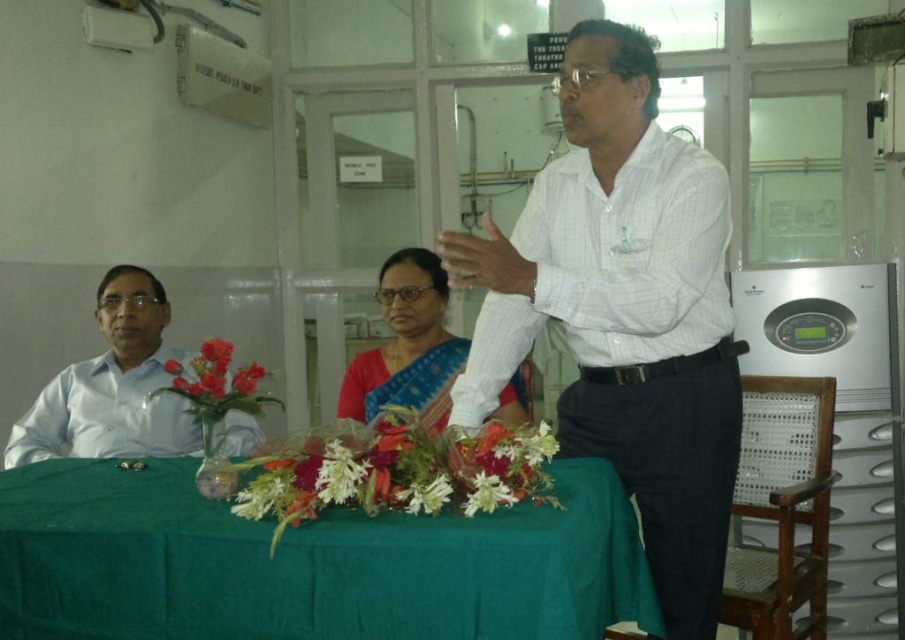
Question: Does white checkered shirt at center appear under white shirt at left?

Choices:
 (A) yes
 (B) no

Answer: (B)

Question: Does satin sari at center appear over matte plastic flowers at left?

Choices:
 (A) yes
 (B) no

Answer: (A)

Question: Among these objects, which one is nearest to the camera?

Choices:
 (A) satin sari at center
 (B) white checkered shirt at center
 (C) white shirt at left
 (D) green fabric table at center

Answer: (D)

Question: Which is farther from the white checkered shirt at center?

Choices:
 (A) white shirt at left
 (B) matte plastic flowers at left
 (C) satin sari at center
 (D) green fabric table at center

Answer: (A)

Question: Which of the following is the farthest from the observer?

Choices:
 (A) (244, 410)
 (B) (710, 342)

Answer: (A)

Question: Is white checkered shirt at center behind white shirt at left?

Choices:
 (A) no
 (B) yes

Answer: (A)